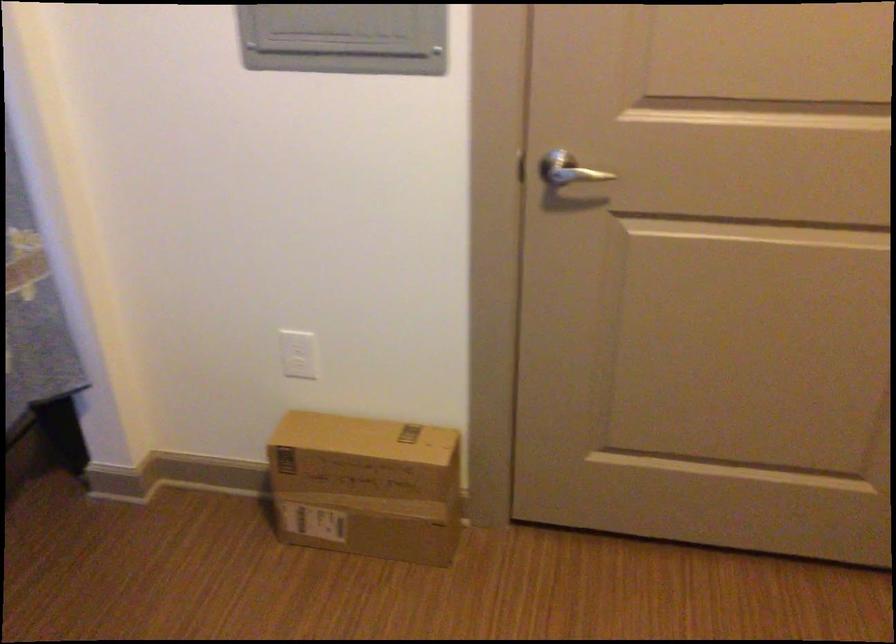
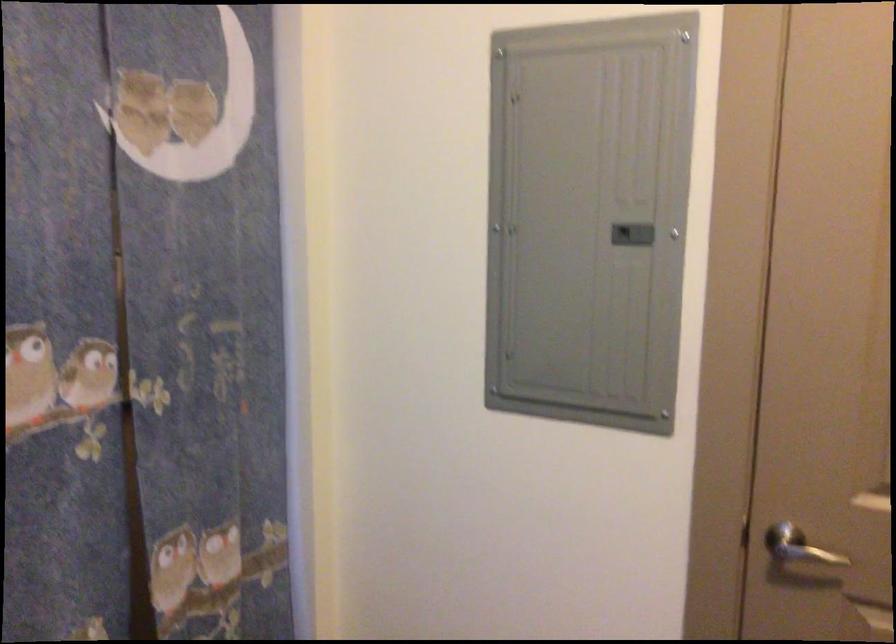
The point at (x=564, y=167) is marked in the first image. Where is the corresponding point in the second image?

(806, 554)